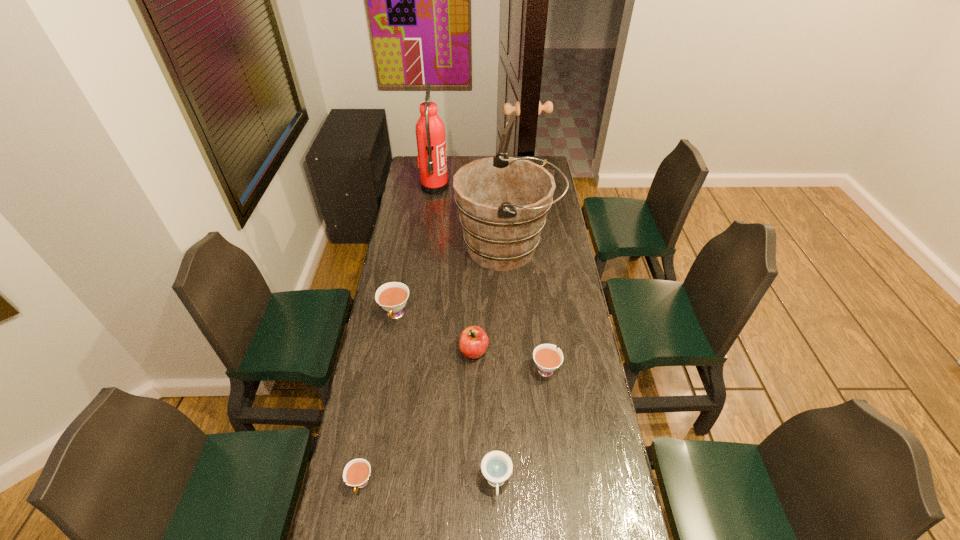
At what (x,y) coordinates should I click in order to perform the action: click on blank region between the farthest teacup and the blue teacup. Please return your answer as a coordinate pair (x, y). This screenshot has width=960, height=540. Looking at the image, I should click on (446, 399).

I want to click on unoccupied position between the smallest white teacup and the fourth farthest object, so click(378, 399).

Identify the location of unoccupied area between the tallest teacup and the fire extinguisher. (415, 251).

Identify the location of free space between the blue teacup and the biggest white teacup. (446, 399).

This screenshot has width=960, height=540. What are the coordinates of `empty space that is in between the bucket and the apple` in the screenshot? It's located at (491, 300).

Locate an element on the screen. vacant area between the phonograph record and the rightmost white teacup is located at coordinates (534, 277).

Find the location of `empty location between the nearest white teacup and the apple`. empty location between the nearest white teacup and the apple is located at coordinates (418, 417).

Image resolution: width=960 pixels, height=540 pixels. Identify the location of object that is the fourth nearest to the second farthest teacup. (392, 297).

At what (x,y) coordinates should I click in order to perform the action: click on the closest object to the red apple. Please return your answer as a coordinate pair (x, y). This screenshot has height=540, width=960. Looking at the image, I should click on (547, 358).

Locate an element on the screen. teacup that is the third closest to the second biggest white teacup is located at coordinates (356, 473).